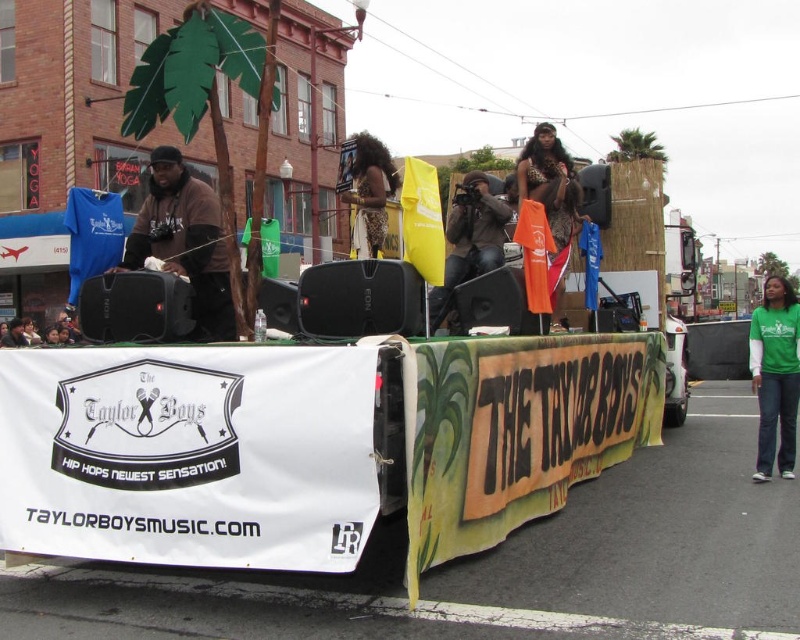
You are a photographer trying to capture a photo of the leopard print dress at center and the matte black camera at center. Since you want both subjects to be in focus, you need to know which one is wider. Which object has a greater width?

The leopard print dress at center has a greater width compared to the matte black camera at center, so you should adjust your camera settings to ensure both are in focus by focusing on the wider object first.

You are a photographer at the event and want to capture both the green cotton shirt at lower right and the leopard print dress at center in the same frame. Which clothing item should you focus on first to ensure both are in the shot?

The green cotton shirt at lower right is located below the leopard print dress at center, so you should focus on the leopard print dress at center first to ensure both are in the shot.